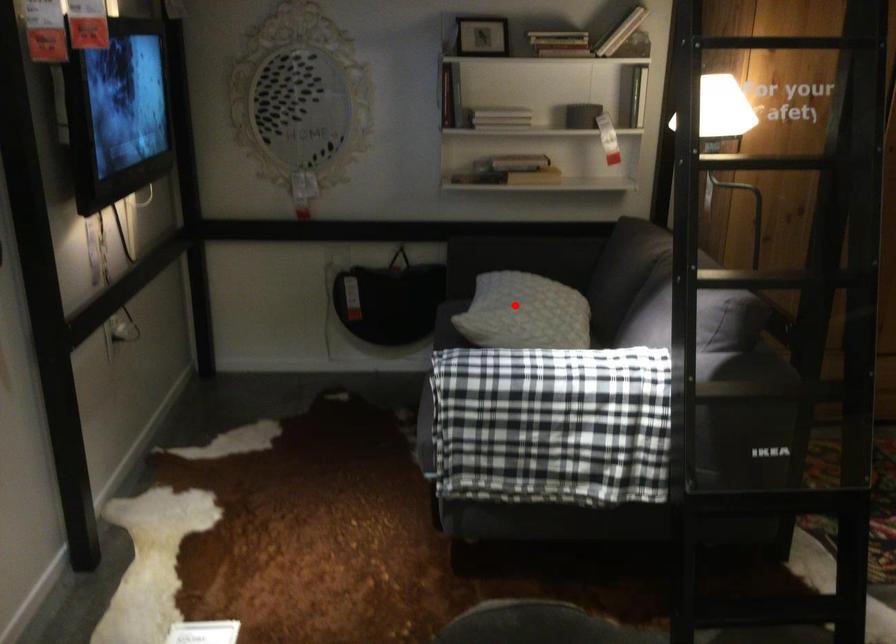
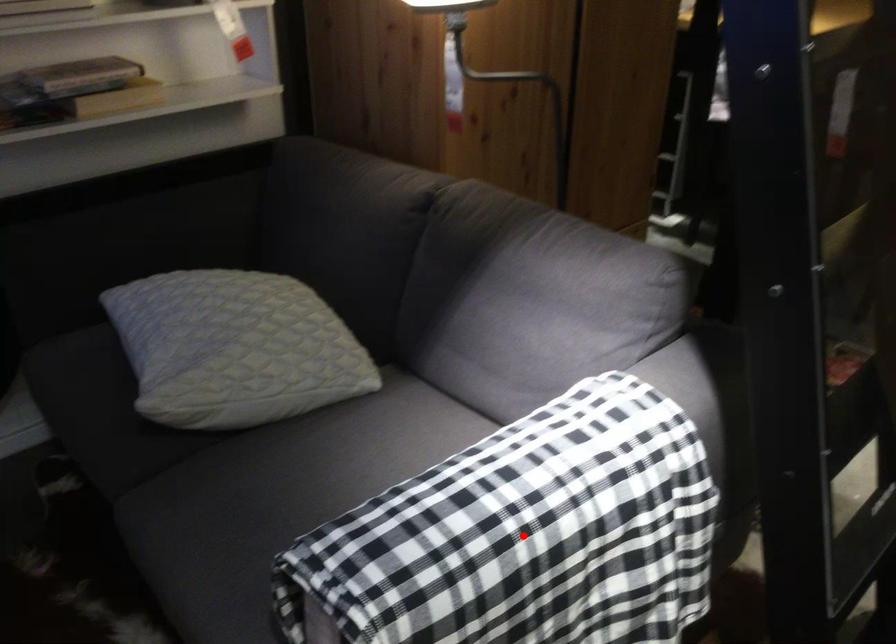
I am providing you with two images of the same scene from different viewpoints. A red point is marked on the first image and another point is marked on the second image. Do the highlighted points in image1 and image2 indicate the same real-world spot?

No